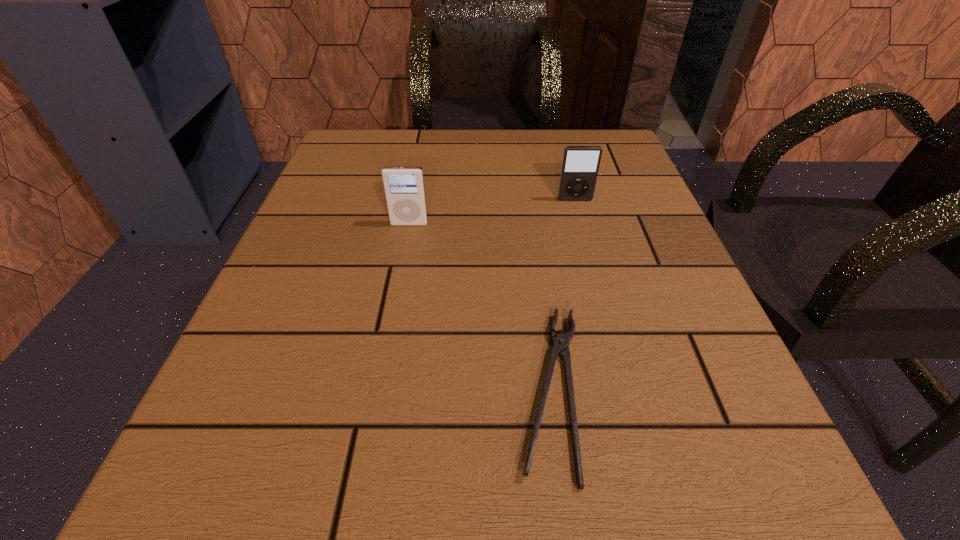
What are the coordinates of `object that can be found as the closest to the second object from right to left` in the screenshot? It's located at (404, 186).

Find the location of a particular element. vacant point that satisfies the following two spatial constraints: 1. on the front-facing side of the leftmost object; 2. on the left side of the tongs is located at coordinates (x=377, y=389).

Where is `vacant space that satisfies the following two spatial constraints: 1. on the front-facing side of the leftmost object; 2. on the right side of the second object from left to right`? vacant space that satisfies the following two spatial constraints: 1. on the front-facing side of the leftmost object; 2. on the right side of the second object from left to right is located at coordinates (377, 389).